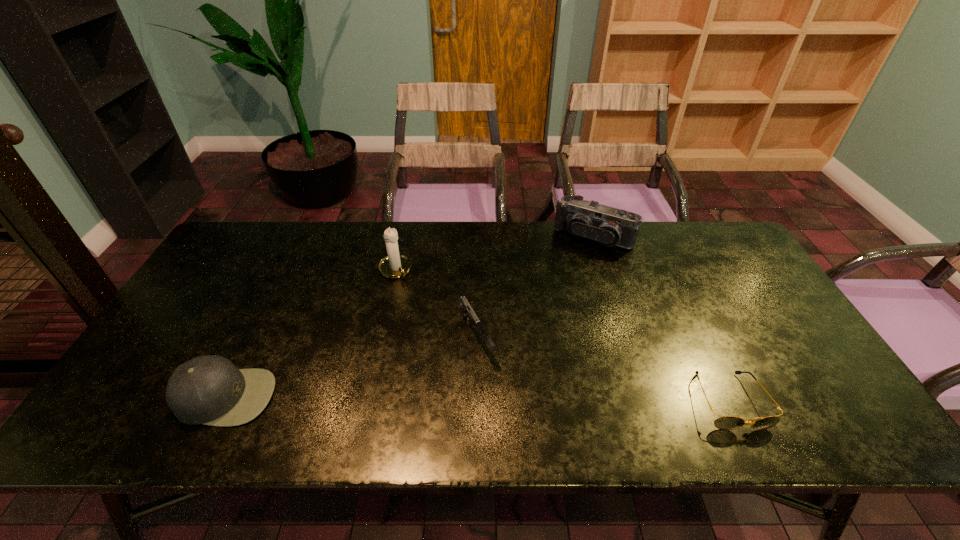
Where is `the leftmost object`? This screenshot has height=540, width=960. the leftmost object is located at coordinates (208, 389).

Find the location of `the third shortest object`. the third shortest object is located at coordinates (208, 389).

Where is `sunglasses`? sunglasses is located at coordinates (725, 422).

Image resolution: width=960 pixels, height=540 pixels. I want to click on the fourth shortest object, so click(x=609, y=226).

You are a GUI agent. You are given a task and a screenshot of the screen. Output one action in this format:
    pyautogui.click(x=<x>, y=<y>)
    Task: Click on the camcorder
    
    Given the screenshot: What is the action you would take?
    pyautogui.click(x=609, y=226)

Locate an element on the screen. candle holder is located at coordinates (395, 265).

At what (x,y) coordinates should I click in order to perform the action: click on the tallest object. Please return your answer as a coordinate pair (x, y). The image size is (960, 540). Looking at the image, I should click on (395, 265).

Image resolution: width=960 pixels, height=540 pixels. What are the coordinates of `the third object from right to left` in the screenshot? It's located at (466, 311).

Locate an element on the screen. the third nearest object is located at coordinates (466, 311).

The image size is (960, 540). I want to click on vacant space located 0.260m on the front-facing side of the camcorder, so click(545, 301).